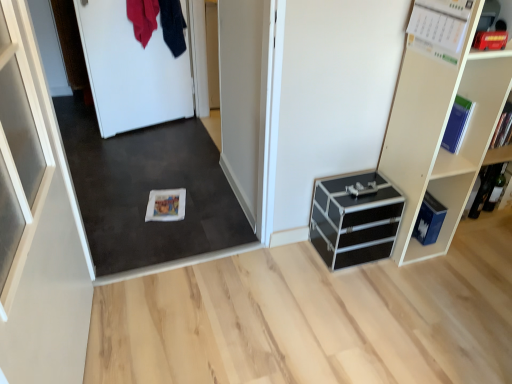
Question: Does blue matte book at upper right, the third book in the back-to-front sequence, have a lesser width compared to white paper calendar at upper right, placed as the 3th book when sorted from right to left?

Choices:
 (A) no
 (B) yes

Answer: (A)

Question: Is the surface of blue matte book at upper right, acting as the second book starting from the front, in direct contact with white paper calendar at upper right, placed as the 2th book when sorted from left to right?

Choices:
 (A) no
 (B) yes

Answer: (A)

Question: Is white paper calendar at upper right, placed as the 3th book when sorted from right to left, completely or partially inside blue matte book at upper right, which ranks as the third book in left-to-right order?

Choices:
 (A) yes
 (B) no

Answer: (B)

Question: Considering the relative sizes of blue matte book at upper right, acting as the second book starting from the front, and white paper calendar at upper right, arranged as the fourth book when viewed from the back, in the image provided, is blue matte book at upper right, acting as the second book starting from the front, taller than white paper calendar at upper right, arranged as the fourth book when viewed from the back,?

Choices:
 (A) yes
 (B) no

Answer: (A)

Question: Are blue matte book at upper right, which ranks as the third book in left-to-right order, and white paper calendar at upper right, placed as the fourth book when sorted from bottom to top, located far from each other?

Choices:
 (A) yes
 (B) no

Answer: (B)

Question: Considering the relative positions of matte white shelf at upper right and white matte carpet at center in the image provided, is matte white shelf at upper right to the left or to the right of white matte carpet at center?

Choices:
 (A) left
 (B) right

Answer: (B)

Question: Relative to white matte carpet at center, is matte white shelf at upper right in front or behind?

Choices:
 (A) front
 (B) behind

Answer: (B)

Question: From their relative heights in the image, would you say matte white shelf at upper right is taller or shorter than white matte carpet at center?

Choices:
 (A) short
 (B) tall

Answer: (B)

Question: From the image's perspective, is matte white shelf at upper right located above or below white matte carpet at center?

Choices:
 (A) above
 (B) below

Answer: (A)

Question: In terms of size, does white matte book at center, which is counted as the fourth book, starting from the top, appear bigger or smaller than dark blue fabric at upper left, which is the second clothing in left-to-right order?

Choices:
 (A) big
 (B) small

Answer: (B)

Question: Looking at their shapes, would you say white matte book at center, which ranks as the first book in back-to-front order, is wider or thinner than dark blue fabric at upper left, marked as the 1th clothing in a right-to-left arrangement?

Choices:
 (A) thin
 (B) wide

Answer: (B)

Question: From a real-world perspective, is white matte book at center, the fourth book when ordered from right to left, physically located above or below dark blue fabric at upper left, which is the second clothing in left-to-right order?

Choices:
 (A) above
 (B) below

Answer: (B)

Question: Would you say white matte book at center, the fourth book when ordered from right to left, is to the left or to the right of dark blue fabric at upper left, which is the second clothing in left-to-right order, in the picture?

Choices:
 (A) right
 (B) left

Answer: (A)

Question: Considering the positions of white paper calendar at upper right, placed as the fourth book when sorted from bottom to top, and black aluminum chest of drawers at lower right in the image, is white paper calendar at upper right, placed as the fourth book when sorted from bottom to top, taller or shorter than black aluminum chest of drawers at lower right?

Choices:
 (A) tall
 (B) short

Answer: (B)

Question: Is white paper calendar at upper right, placed as the 2th book when sorted from left to right, in front of or behind black aluminum chest of drawers at lower right in the image?

Choices:
 (A) behind
 (B) front

Answer: (B)